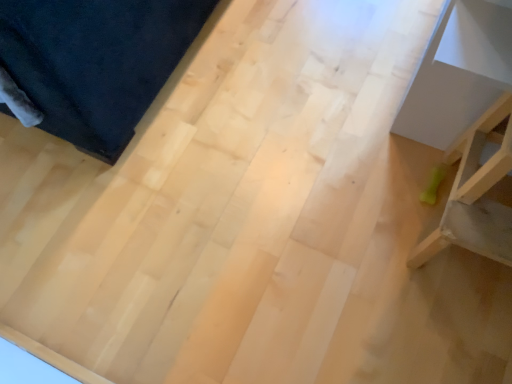
This screenshot has height=384, width=512. I want to click on green rubber bone at lower right, so click(476, 193).

Describe the element at coordinates (476, 193) in the screenshot. I see `green rubber bone at lower right` at that location.

What are the coordinates of `green rubber bone at lower right` in the screenshot? It's located at (476, 193).